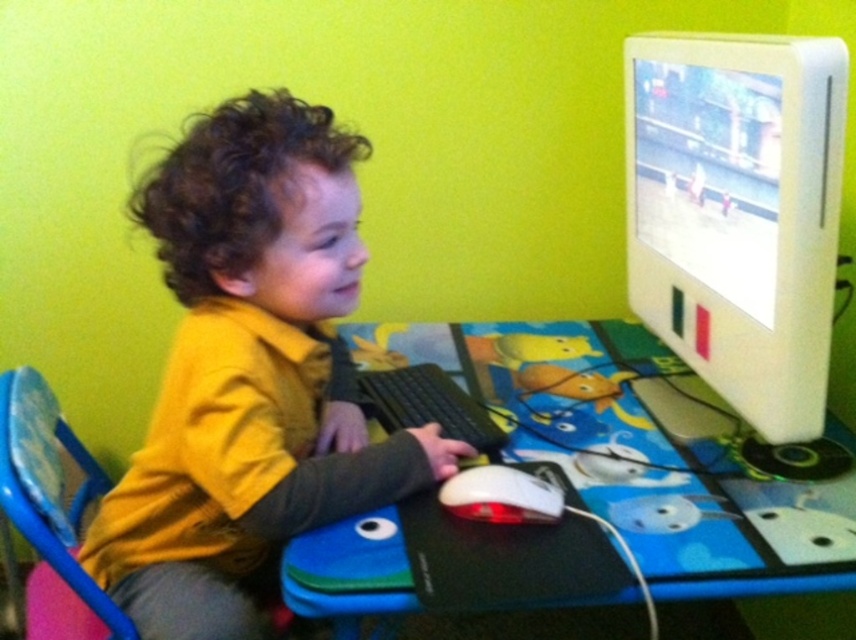
Question: Which object is closer to the camera taking this photo?

Choices:
 (A) pink plastic chair at lower left
 (B) blue plastic computer desk at center
 (C) black plastic keyboard at center

Answer: (B)

Question: Which object is the closest to the yellow matte shirt at center?

Choices:
 (A) pink plastic chair at lower left
 (B) blue plastic computer desk at center
 (C) white matte mouse at center
 (D) black plastic keyboard at center

Answer: (D)

Question: Is yellow matte shirt at center to the left of white plastic monitor at upper right from the viewer's perspective?

Choices:
 (A) yes
 (B) no

Answer: (A)

Question: Is white plastic monitor at upper right below pink plastic chair at lower left?

Choices:
 (A) yes
 (B) no

Answer: (B)

Question: Which object is positioned farthest from the white matte mouse at center?

Choices:
 (A) yellow matte shirt at center
 (B) pink plastic chair at lower left
 (C) blue plastic computer desk at center
 (D) white plastic monitor at upper right

Answer: (B)

Question: From the image, what is the correct spatial relationship of yellow matte shirt at center in relation to white matte mouse at center?

Choices:
 (A) above
 (B) below

Answer: (A)